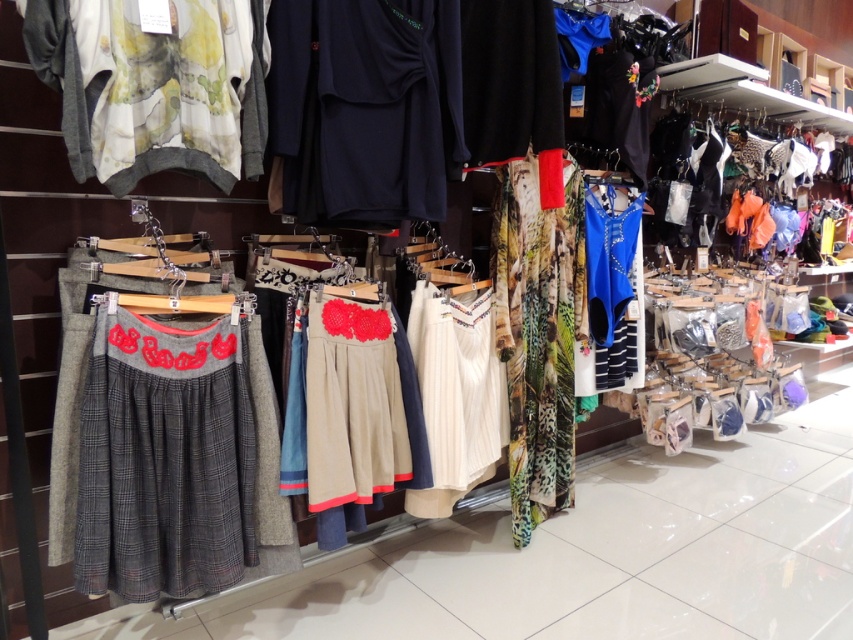
Question: Does printed fabric dress at center lie behind beige fabric skirt at center?

Choices:
 (A) no
 (B) yes

Answer: (B)

Question: Where is plaid wool skirt at center located in relation to printed fabric dress at center in the image?

Choices:
 (A) right
 (B) left

Answer: (B)

Question: Is navy blue fabric dress at center closer to the viewer compared to watercolor fabric blouse at upper left?

Choices:
 (A) yes
 (B) no

Answer: (B)

Question: Which point is farther to the camera?

Choices:
 (A) (431, 404)
 (B) (274, 88)

Answer: (A)

Question: Which object is the farthest from the watercolor fabric blouse at upper left?

Choices:
 (A) white textured dress at center
 (B) navy blue fabric dress at center
 (C) black matte sweater at center

Answer: (A)

Question: Which point is farther from the camera taking this photo?

Choices:
 (A) click(x=215, y=342)
 (B) click(x=325, y=424)
 (C) click(x=96, y=29)
 (D) click(x=556, y=452)

Answer: (D)